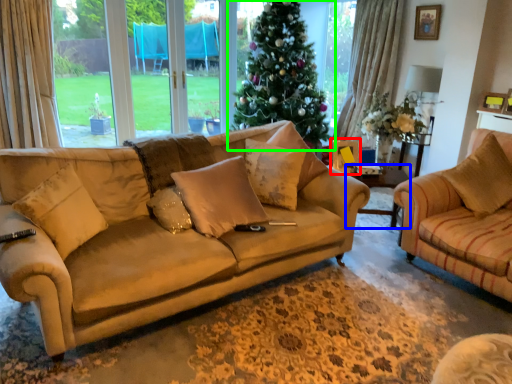
Question: Which is nearer to the picture frame (highlighted by a red box)? side table (highlighted by a blue box) or christmas tree (highlighted by a green box).

Choices:
 (A) side table
 (B) christmas tree

Answer: (A)